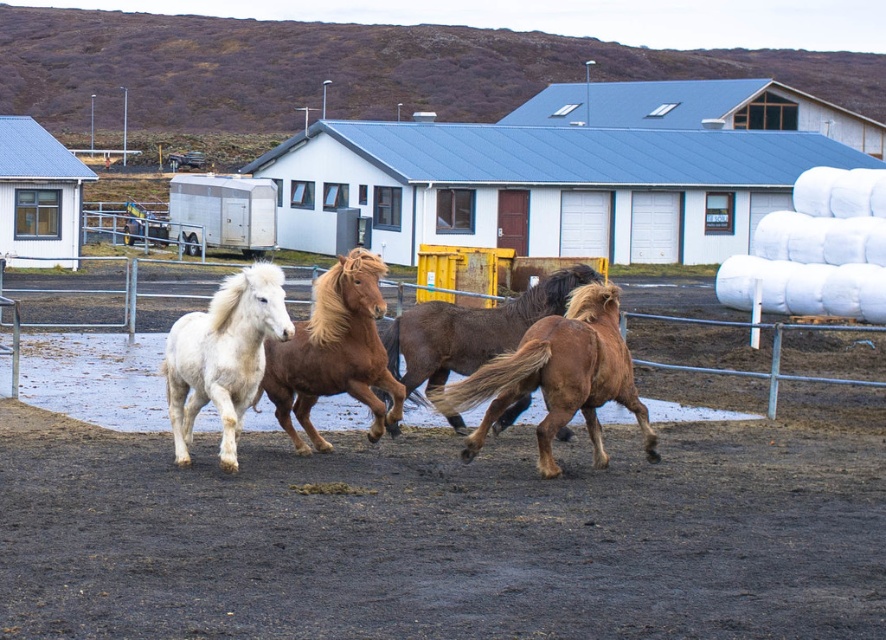
You are a farmer who needs to identify the bigger horse to assign heavier tasks. Looking at the brown silky horse at center and the brown glossy horse at center, which one should you choose?

The brown silky horse at center is larger in size than the brown glossy horse at center, so you should choose the brown silky horse at center for heavier tasks.

You are a farmer who wants to check the condition of the damp brown dirt at center where the brown silky horse at center is standing. From your observation point, which object is lower in position?

The damp brown dirt at center is located below the brown silky horse at center, so the damp brown dirt at center is lower in position.

You are a farmer who needs to separate two horses for feeding. The brown silky horse at center and the brown glossy horse at center are currently too close. What is the minimum distance you need to move one of them to ensure they are at least 2 meters apart?

The brown silky horse at center and brown glossy horse at center are currently 1.26 meters apart. To reach the required 2 meters, you need to move one of them by at least 0.74 meters away from the other.